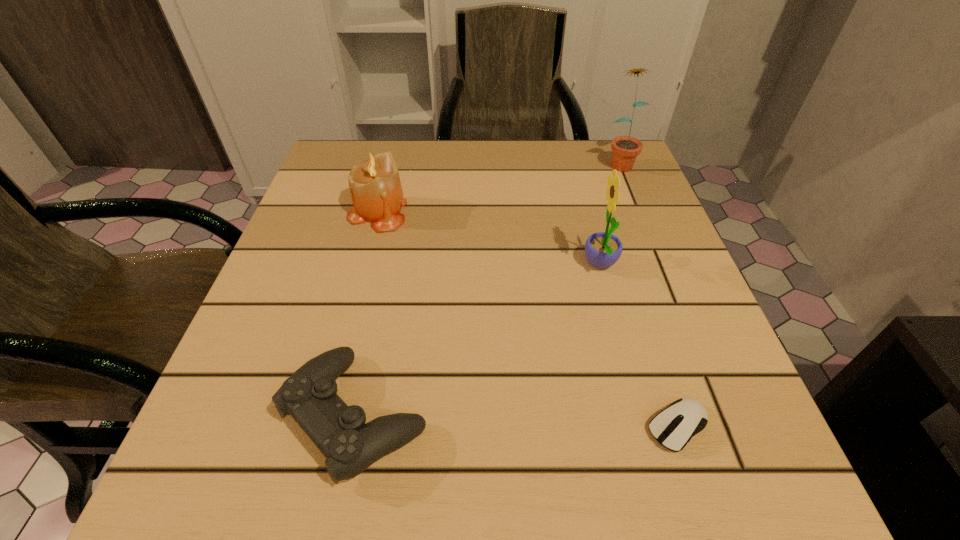
Image resolution: width=960 pixels, height=540 pixels. Identify the location of vacant space situated on the front-facing side of the left sunflower. (365, 265).

At what (x,y) coordinates should I click in order to perform the action: click on free space located 0.140m on the front-facing side of the left sunflower. Please return your answer as a coordinate pair (x, y). Looking at the image, I should click on (506, 265).

At what (x,y) coordinates should I click in order to perform the action: click on vacant space located on the front of the second farthest object. Please return your answer as a coordinate pair (x, y). Looking at the image, I should click on (364, 266).

Locate an element on the screen. This screenshot has height=540, width=960. free region located 0.180m on the back of the control is located at coordinates (385, 271).

You are a GUI agent. You are given a task and a screenshot of the screen. Output one action in this format:
    pyautogui.click(x=<x>, y=<y>)
    Task: Click on the free point located 0.190m on the back of the mouse
    Image resolution: width=960 pixels, height=540 pixels.
    Given the screenshot: What is the action you would take?
    pyautogui.click(x=636, y=299)

The image size is (960, 540). Find the location of `sunflower at the far edge`. sunflower at the far edge is located at coordinates (625, 149).

You are a GUI agent. You are given a task and a screenshot of the screen. Output one action in this format:
    pyautogui.click(x=<x>, y=<y>)
    Task: Click on the candle that is at the far edge
    
    Given the screenshot: What is the action you would take?
    pyautogui.click(x=375, y=187)

I want to click on control that is at the near edge, so click(309, 395).

Where is `mouse present at the near edge`? This screenshot has height=540, width=960. mouse present at the near edge is located at coordinates (673, 427).

The height and width of the screenshot is (540, 960). I want to click on candle that is at the left edge, so click(x=375, y=187).